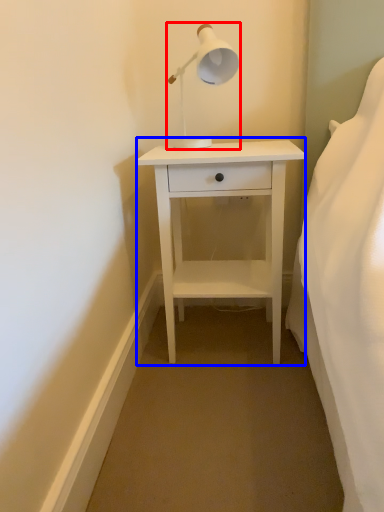
Question: Which object is further to the camera taking this photo, lamp (highlighted by a red box) or nightstand (highlighted by a blue box)?

Choices:
 (A) lamp
 (B) nightstand

Answer: (B)